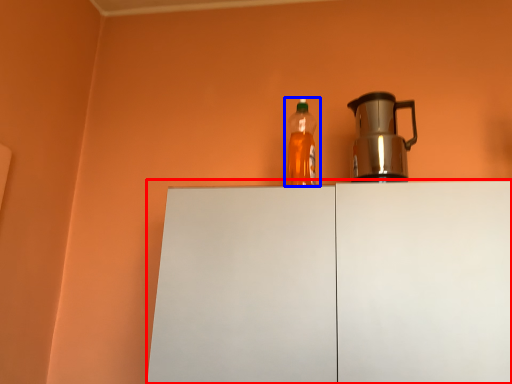
Question: Which object is closer to the camera taking this photo, cabinetry (highlighted by a red box) or bottle (highlighted by a blue box)?

Choices:
 (A) cabinetry
 (B) bottle

Answer: (A)